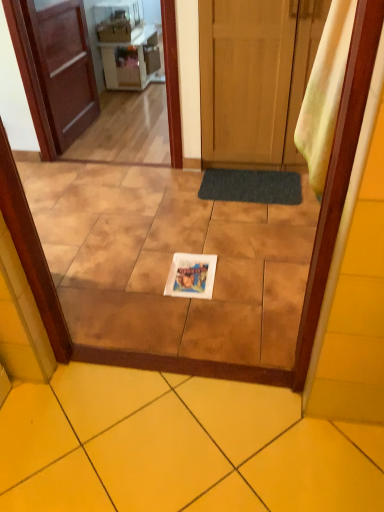
Identify the location of free space in front of dark gray textured bath mat at center. This screenshot has width=384, height=512. (253, 238).